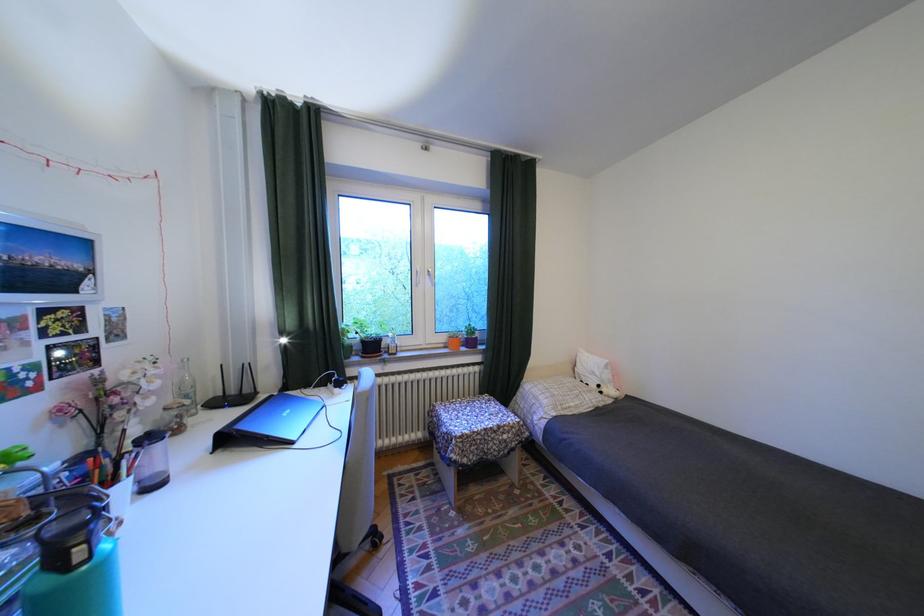
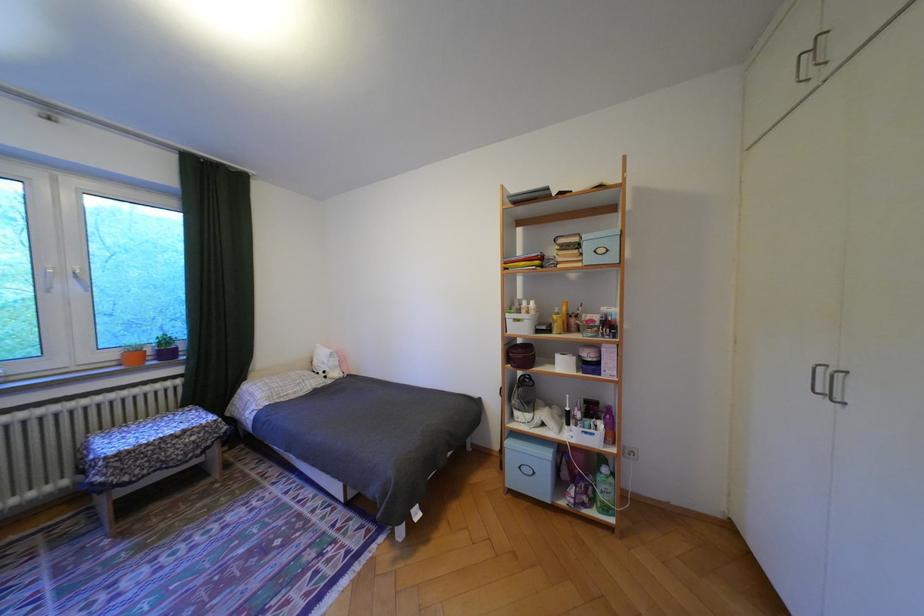
Locate, in the second image, the point that corresponds to (482,342) in the first image.

(178, 354)